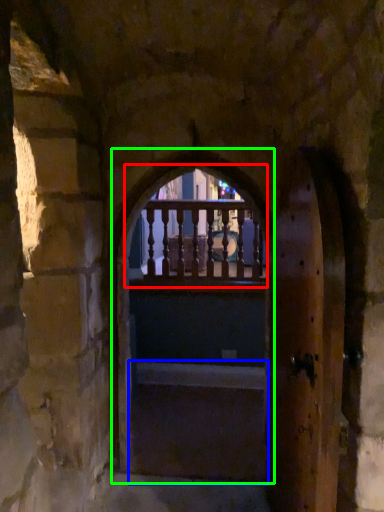
Question: Considering the real-world distances, which object is closest to glass window (highlighted by a red box)? stairs (highlighted by a blue box) or window frame (highlighted by a green box).

Choices:
 (A) stairs
 (B) window frame

Answer: (B)